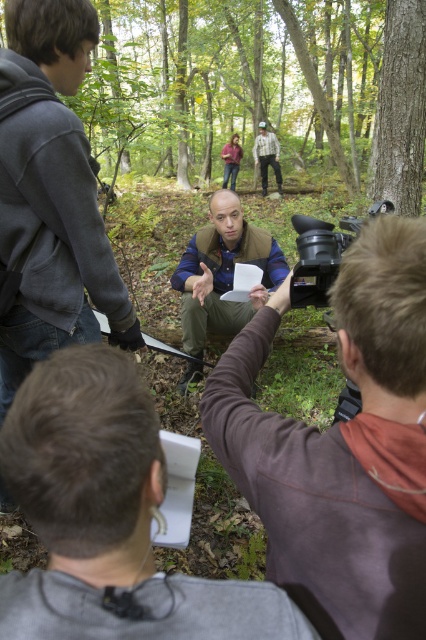
Does gray matte paper at lower center appear under dark gray hoodie at left?

Yes.

Between point (20, 602) and point (69, 214), which one is positioned behind?

Point (69, 214)

Identify the location of gray matte paper at lower center. The width and height of the screenshot is (426, 640). (109, 516).

Does blue fabric shirt at center appear on the left side of smooth bark tree at upper right?

Correct, you'll find blue fabric shirt at center to the left of smooth bark tree at upper right.

Who is lower down, blue fabric shirt at center or smooth bark tree at upper right?

blue fabric shirt at center is lower down.

Identify the location of blue fabric shirt at center. The width and height of the screenshot is (426, 640). (342, 448).

Between gray matte paper at lower center and blue denim jacket at center, which one is positioned lower?

Positioned lower is gray matte paper at lower center.

From the picture: Can you confirm if gray matte paper at lower center is positioned above blue denim jacket at center?

No, gray matte paper at lower center is not above blue denim jacket at center.

Between point (80, 483) and point (192, 340), which one is positioned behind?

The point (192, 340) is behind.

Locate an element on the screen. gray matte paper at lower center is located at coordinates (109, 516).